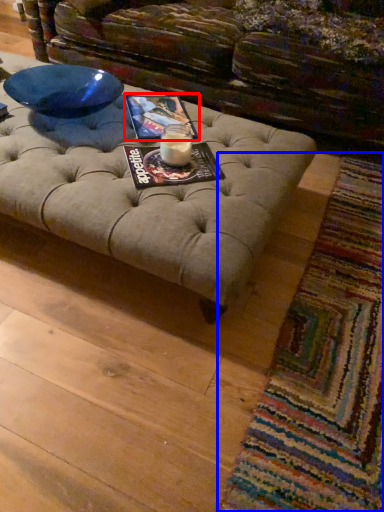
Question: Which of the following is the closest to the observer, magazine (highlighted by a red box) or mat (highlighted by a blue box)?

Choices:
 (A) magazine
 (B) mat

Answer: (B)